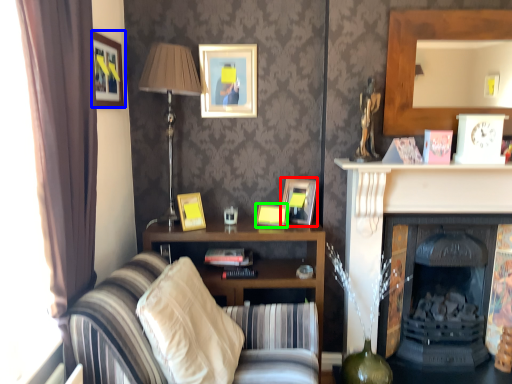
Question: Which object is the farthest from picture frame (highlighted by a red box)? Choose among these: picture frame (highlighted by a blue box) or picture frame (highlighted by a green box).

Choices:
 (A) picture frame
 (B) picture frame

Answer: (A)